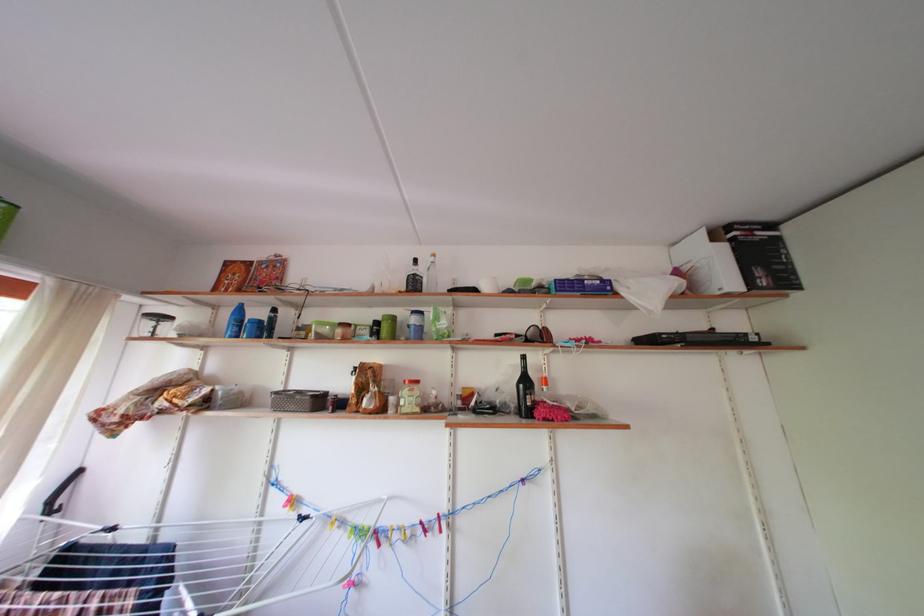
Find where to lift the green lidded container. Please return your answer as a coordinate pair (x, y).

(387, 326)